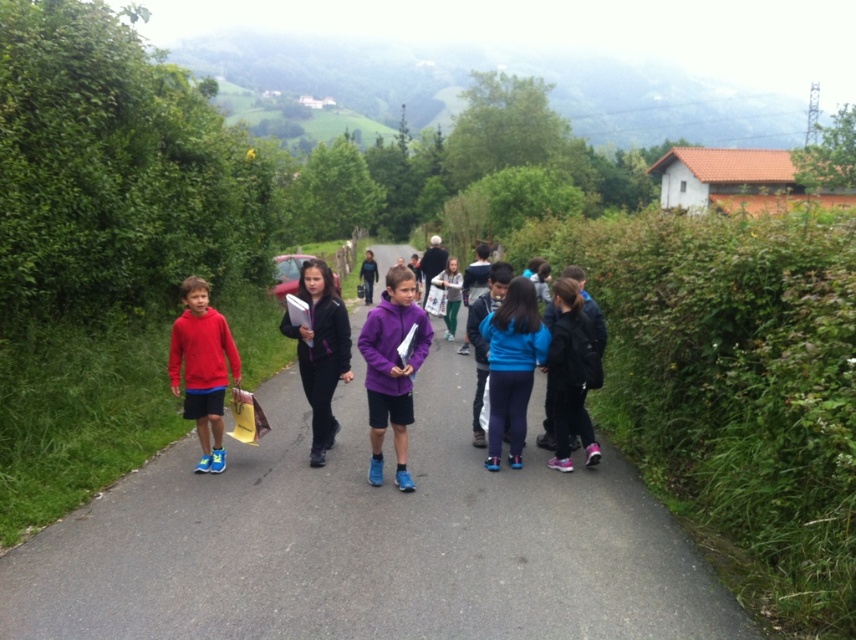
Question: Which point is closer to the camera?

Choices:
 (A) (105, 557)
 (B) (321, 260)

Answer: (A)

Question: Is smooth asphalt road at center to the right of blue fleece jacket at center from the viewer's perspective?

Choices:
 (A) no
 (B) yes

Answer: (A)

Question: Is matte red hoodie at left to the left of blue fleece jacket at center from the viewer's perspective?

Choices:
 (A) no
 (B) yes

Answer: (B)

Question: Considering the real-world distances, which object is closest to the smooth asphalt road at center?

Choices:
 (A) purple fleece jacket at center
 (B) matte red hoodie at left
 (C) black matte jacket at center
 (D) blue fleece jacket at center

Answer: (D)

Question: Which point is farther to the camera?

Choices:
 (A) blue fleece jacket at center
 (B) black matte jacket at center
 (C) purple fleece jacket at center
 (D) matte red hoodie at left

Answer: (B)

Question: Is purple fleece jacket at center positioned in front of matte red hoodie at left?

Choices:
 (A) yes
 (B) no

Answer: (A)